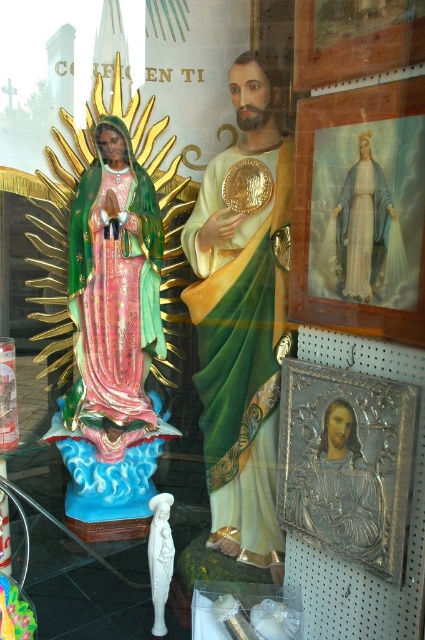
Looking at this image, does polished gold statue at center appear on the left side of shiny pink statue at left?

In fact, polished gold statue at center is to the right of shiny pink statue at left.

Can you confirm if polished gold statue at center is positioned to the right of shiny pink statue at left?

Yes, polished gold statue at center is to the right of shiny pink statue at left.

Is point (234, 256) more distant than point (85, 420)?

No, it is in front of (85, 420).

Find the location of a particular element. The image size is (425, 640). polished gold statue at center is located at coordinates point(243,323).